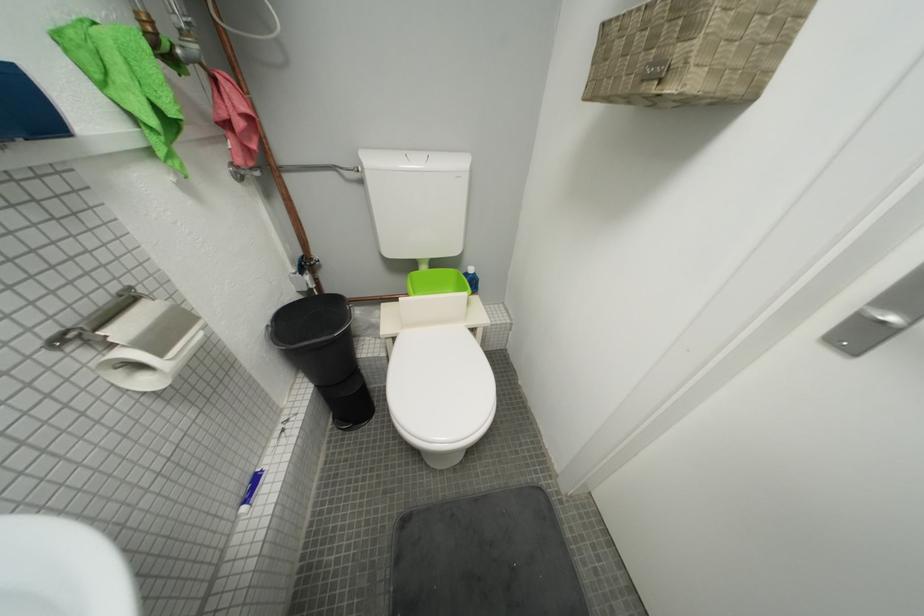
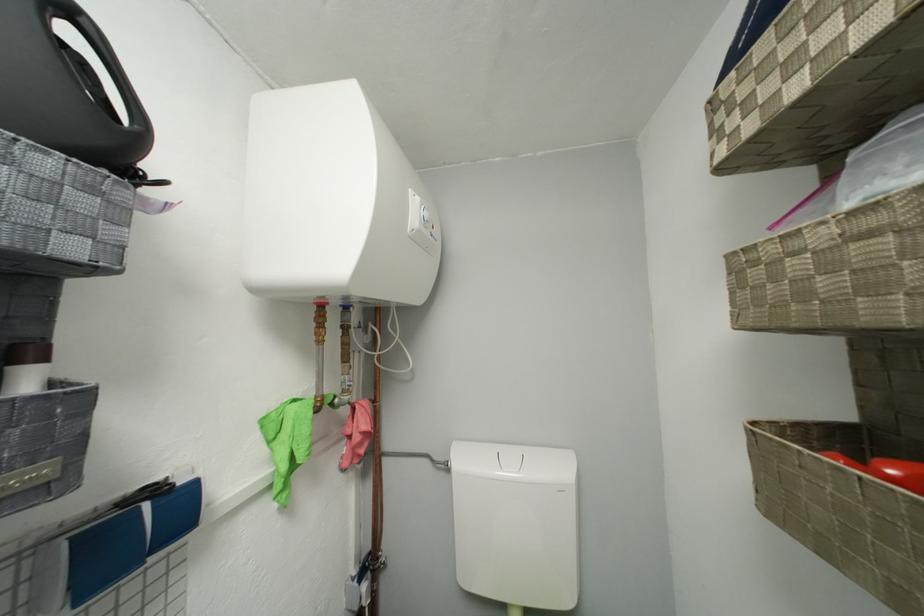
Based on the continuous images, in which direction is the camera rotating?

The camera's rotation is toward left-up.